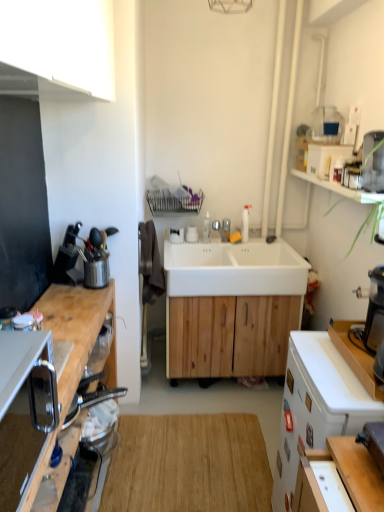
Question: Is point (109, 48) closer or farther from the camera than point (225, 222)?

Choices:
 (A) closer
 (B) farther

Answer: (A)

Question: Considering the positions of white matte cabinet at upper left, arranged as the 1th cabinetry when viewed from the top, and white glossy faucet at center in the image, is white matte cabinet at upper left, arranged as the 1th cabinetry when viewed from the top, bigger or smaller than white glossy faucet at center?

Choices:
 (A) small
 (B) big

Answer: (B)

Question: Estimate the real-world distances between objects in this image. Which object is closer to the white matte sink at center?

Choices:
 (A) natural wood cutting board at center
 (B) satin silver phone at left
 (C) white matte desk at right
 (D) white matte counter top at right
 (E) white glossy faucet at center

Answer: (E)

Question: Which object is positioned farthest from the natural wood cutting board at center?

Choices:
 (A) metallic silver utensil holder at left
 (B) white matte cabinet at upper left, arranged as the 1th cabinetry when viewed from the top
 (C) white matte sink at center
 (D) white glossy faucet at center
 (E) white matte counter top at right

Answer: (B)